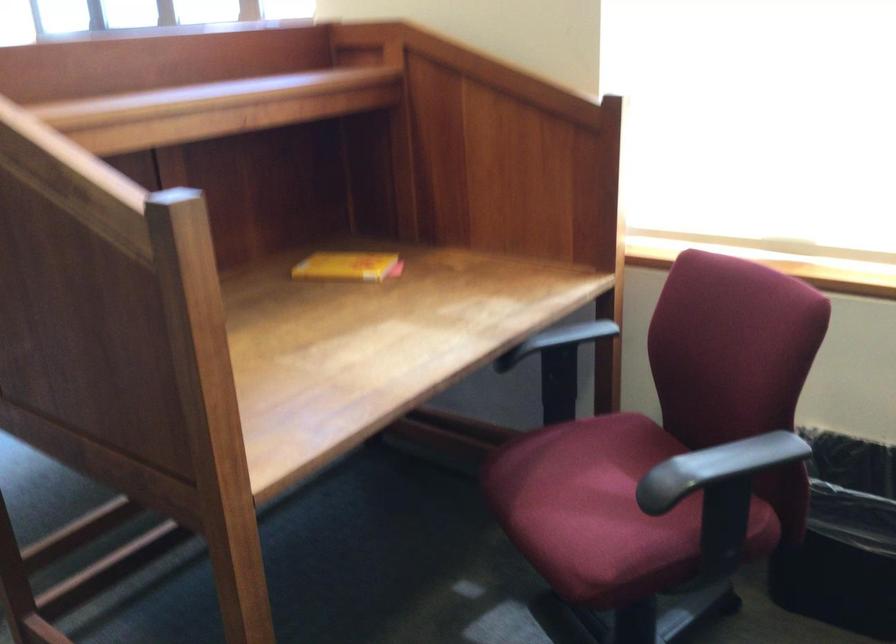
How did the camera likely rotate?

The camera rotated toward left-down.